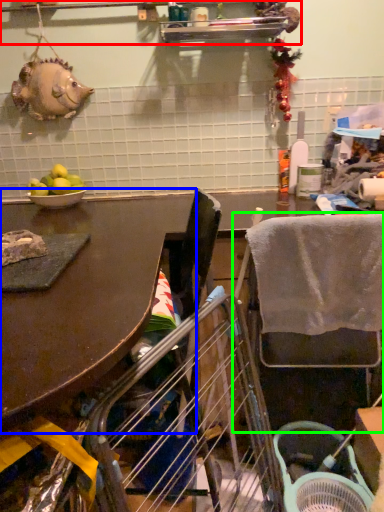
Question: Which object is the farthest from shelf (highlighted by a red box)? Choose among these: table (highlighted by a blue box) or chair (highlighted by a green box).

Choices:
 (A) table
 (B) chair

Answer: (B)